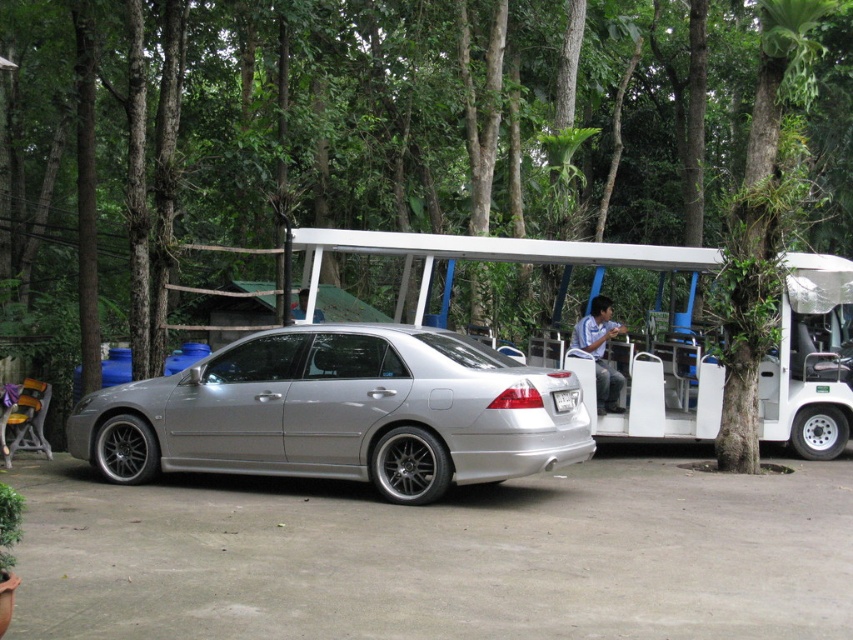
You are standing at the origin point of the coordinate system. You want to walk towards the green leafy tree at center. What direction should you move in?

The green leafy tree at center is located at point (341,136). Since coordinates are relative to the image, moving towards the center of the image would involve moving in the positive x and y directions from the origin, but since the tree is already at the center, you might need to adjust based on your current position. However, given the coordinate provided, the tree is at 0.214 on the x and 0.402 on the y, so if the origin is the bottom left corner, moving towards the center would require moving right a

You are a park ranger who needs to park your white plastic golf cart at center. There is a space available next to the white plastic license plate at rear. Can your golf cart fit in the space if the license plate takes up most of it?

The white plastic golf cart at center is smaller than the white plastic license plate at rear, so it might not fit in the space if the license plate already occupies most of it.